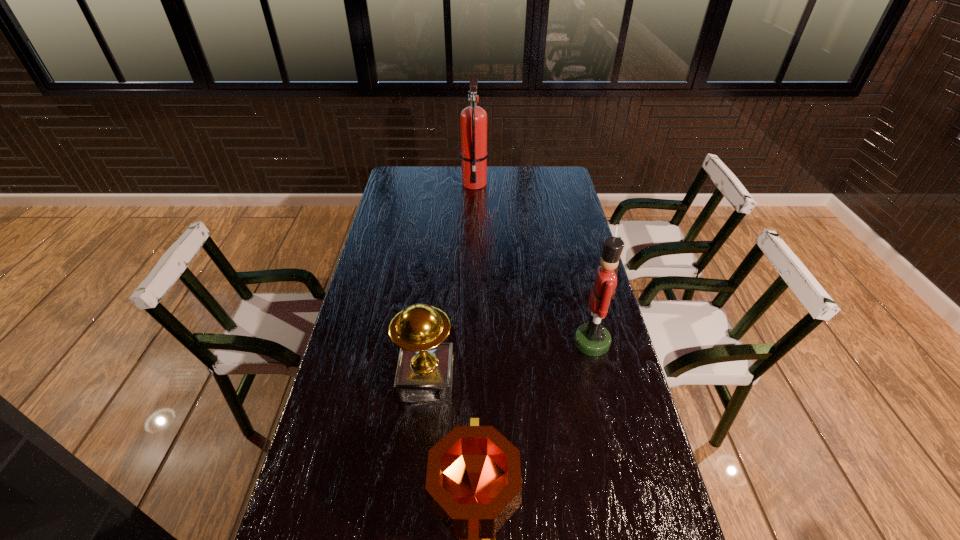
The image size is (960, 540). I want to click on fire extinguisher, so click(x=473, y=119).

Locate an element on the screen. The height and width of the screenshot is (540, 960). the rightmost object is located at coordinates (592, 339).

Where is `the third nearest object`? the third nearest object is located at coordinates (592, 339).

This screenshot has height=540, width=960. In order to click on the second nearest object in this screenshot , I will do [424, 374].

Identify the location of vacant space situated 0.230m on the hose direction of the farthest object. (473, 224).

This screenshot has width=960, height=540. In order to click on vacant area situated on the front-facing side of the second farthest object in this screenshot , I will do `click(475, 342)`.

Identify the location of free spot located 0.170m on the front-facing side of the second farthest object. (519, 342).

You are a GUI agent. You are given a task and a screenshot of the screen. Output one action in this format:
    pyautogui.click(x=<x>, y=<y>)
    Task: Click on the free location located on the front-facing side of the second farthest object
    
    Given the screenshot: What is the action you would take?
    pyautogui.click(x=529, y=342)

The image size is (960, 540). In order to click on vacant space located 0.170m on the front-facing side of the farther award in this screenshot , I will do `click(418, 465)`.

Locate an element on the screen. Image resolution: width=960 pixels, height=540 pixels. object situated at the far edge is located at coordinates (473, 119).